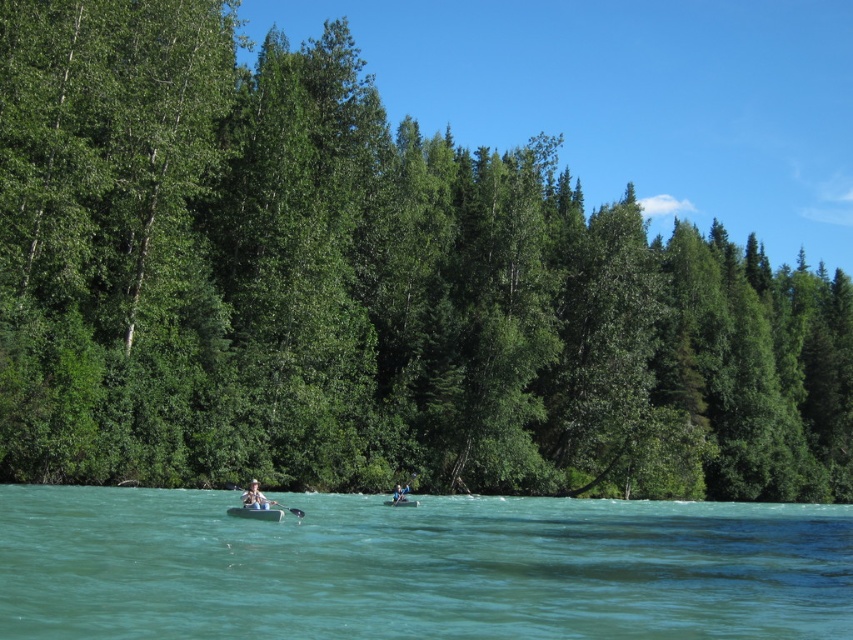
Who is higher up, green rubber boat at center or light brown wooden paddle at center?

green rubber boat at center is higher up.

Can you confirm if green rubber boat at center is shorter than light brown wooden paddle at center?

Yes.

Between point (270, 518) and point (393, 500), which one is positioned behind?

The point (393, 500) is behind.

At what (x,y) coordinates should I click in order to perform the action: click on green rubber boat at center. Please return your answer as a coordinate pair (x, y). The image size is (853, 640). Looking at the image, I should click on (256, 513).

Is clear turquoise water at center to the left of matte white canoe at center from the viewer's perspective?

Incorrect, clear turquoise water at center is not on the left side of matte white canoe at center.

Can you confirm if clear turquoise water at center is shorter than matte white canoe at center?

In fact, clear turquoise water at center may be taller than matte white canoe at center.

Identify the location of clear turquoise water at center. The image size is (853, 640). (416, 566).

Who is shorter, clear turquoise water at center or light brown wooden paddle at center?

light brown wooden paddle at center is shorter.

Describe the element at coordinates (416, 566) in the screenshot. I see `clear turquoise water at center` at that location.

The image size is (853, 640). I want to click on clear turquoise water at center, so click(416, 566).